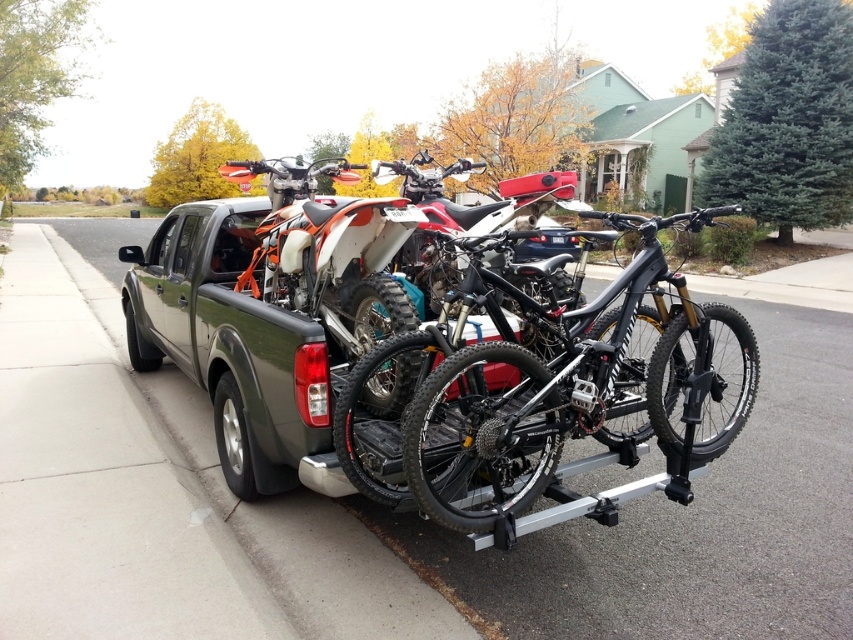
Question: Where is black matte bicycle at center located in relation to matte black dirt bike at center in the image?

Choices:
 (A) right
 (B) left

Answer: (B)

Question: Which point appears farthest from the camera in this image?

Choices:
 (A) (434, 205)
 (B) (508, 512)

Answer: (A)

Question: Does black matte bicycle at center have a larger size compared to matte black dirt bike at center?

Choices:
 (A) no
 (B) yes

Answer: (A)

Question: Which point is closer to the camera?

Choices:
 (A) matte black dirt bike at center
 (B) black matte bicycle at center

Answer: (B)

Question: Does black matte bicycle at center appear on the right side of matte black dirt bike at center?

Choices:
 (A) no
 (B) yes

Answer: (A)